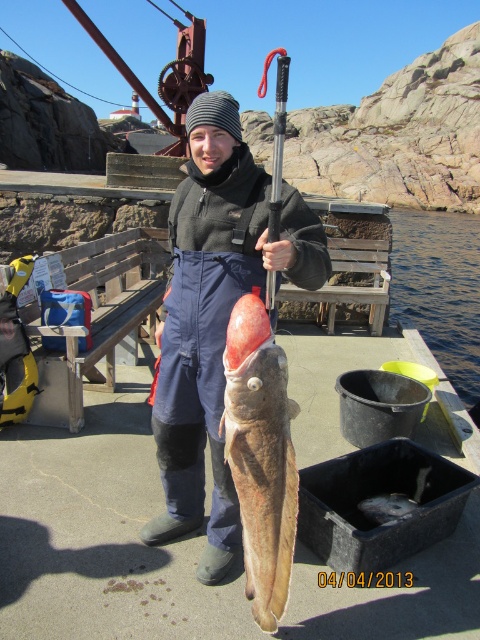
Question: Among these points, which one is nearest to the camera?

Choices:
 (A) (240, 522)
 (B) (199, 516)
 (C) (412, 499)

Answer: (A)

Question: Which object is closer to the camera taking this photo?

Choices:
 (A) dark blue waterproof suit at center
 (B) shiny silver fish at center
 (C) smooth brown fish at center

Answer: (C)

Question: Can you confirm if dark blue waterproof suit at center is smaller than smooth brown fish at center?

Choices:
 (A) yes
 (B) no

Answer: (B)

Question: Which is nearer to the dark blue waterproof suit at center?

Choices:
 (A) smooth brown fish at center
 (B) shiny silver fish at center

Answer: (A)

Question: Is dark blue waterproof suit at center to the right of shiny silver fish at center from the viewer's perspective?

Choices:
 (A) yes
 (B) no

Answer: (B)

Question: Is the position of dark blue waterproof suit at center less distant than that of smooth brown fish at center?

Choices:
 (A) yes
 (B) no

Answer: (B)